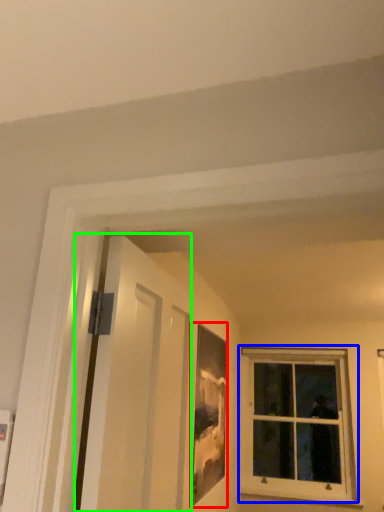
Question: Considering the real-world distances, which object is farthest from picture frame (highlighted by a red box)? window (highlighted by a blue box) or screen door (highlighted by a green box)?

Choices:
 (A) window
 (B) screen door

Answer: (A)